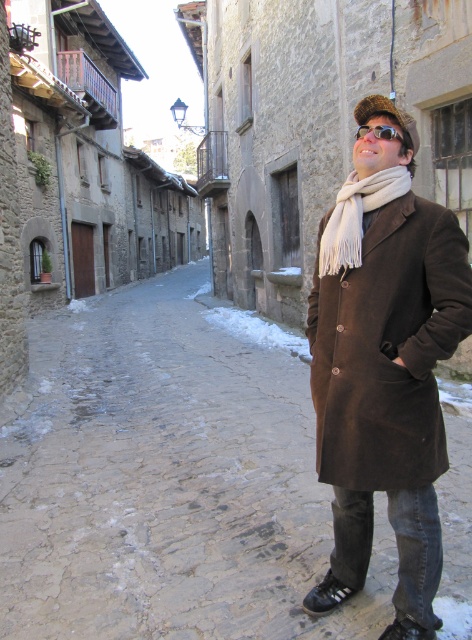
Question: Considering the real-world distances, which object is farthest from the white fringed scarf at center?

Choices:
 (A) suede coat at center
 (B) sunglasses at upper center

Answer: (B)

Question: Among these objects, which one is nearest to the camera?

Choices:
 (A) suede coat at center
 (B) sunglasses at upper center

Answer: (A)

Question: Where is suede coat at center located in relation to white fringed scarf at center in the image?

Choices:
 (A) above
 (B) below

Answer: (B)

Question: Considering the relative positions of brown suede coat at right and sunglasses at upper center in the image provided, where is brown suede coat at right located with respect to sunglasses at upper center?

Choices:
 (A) left
 (B) right

Answer: (A)

Question: Considering the real-world distances, which object is farthest from the suede coat at center?

Choices:
 (A) sunglasses at upper center
 (B) white fringed scarf at center
 (C) brown suede coat at right

Answer: (C)

Question: Does brown suede coat at right lie in front of white fringed scarf at center?

Choices:
 (A) yes
 (B) no

Answer: (B)